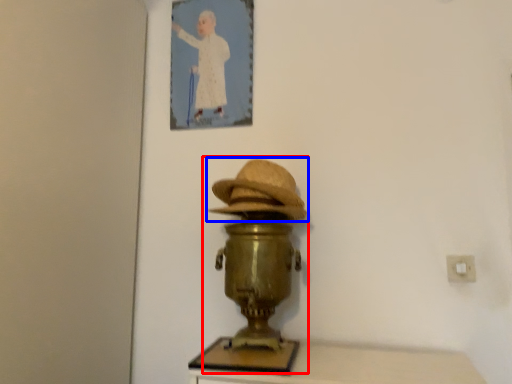
Question: Which of the following is the closest to the observer, table lamp (highlighted by a red box) or hat (highlighted by a blue box)?

Choices:
 (A) table lamp
 (B) hat

Answer: (A)